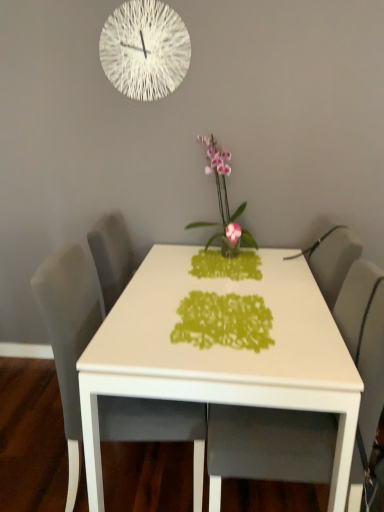
Where is `free location to the left of green paper cutout at center`? free location to the left of green paper cutout at center is located at coordinates (138, 327).